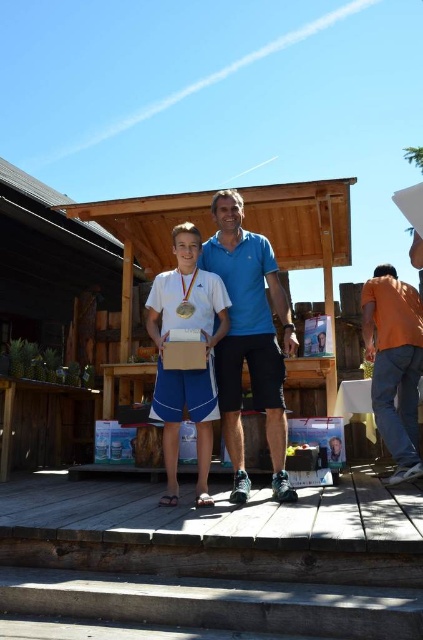
Does blue fabric shirt at center have a greater height compared to gold metallic medal at center?

Yes.

Find the location of a particular element. blue fabric shirt at center is located at coordinates (249, 339).

Between point (209, 241) and point (187, 301), which one is positioned in front?

Point (187, 301)

Image resolution: width=423 pixels, height=640 pixels. I want to click on blue fabric shirt at center, so click(x=249, y=339).

Is white matte tennis racket at center wider than orange cotton shirt at right?

Yes.

Between point (169, 412) and point (373, 378), which one is positioned in front?

Point (169, 412) is in front.

This screenshot has height=640, width=423. What do you see at coordinates (186, 369) in the screenshot? I see `white matte tennis racket at center` at bounding box center [186, 369].

This screenshot has width=423, height=640. I want to click on white matte tennis racket at center, so click(x=186, y=369).

Is blue fabric shirt at center positioned before white matte tennis racket at center?

No, it is not.

Is point (211, 237) positioned behind point (165, 417)?

That is True.

Between point (233, 426) and point (184, 284), which one is positioned in front?

Point (233, 426) is in front.

This screenshot has width=423, height=640. I want to click on blue fabric shirt at center, so click(x=249, y=339).